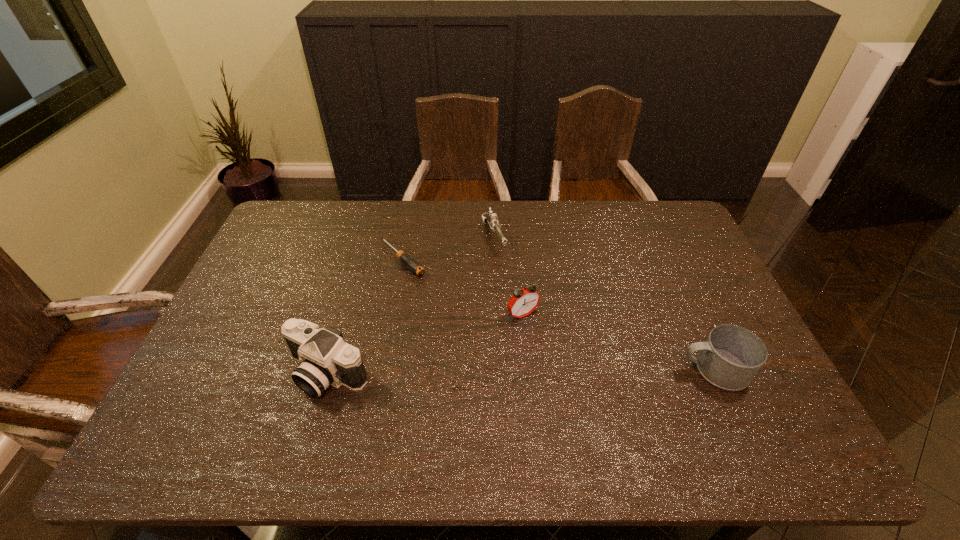
Identify the location of object that stands as the third closest to the rightmost object. (414, 266).

Identify the location of blank area in the image that satisfies the following two spatial constraints: 1. on the back side of the alarm clock; 2. on the right side of the tallest object. (345, 315).

Where is `free spot that satisfies the following two spatial constraints: 1. on the back side of the third farthest object; 2. on the right side of the tallest object`? This screenshot has height=540, width=960. free spot that satisfies the following two spatial constraints: 1. on the back side of the third farthest object; 2. on the right side of the tallest object is located at coordinates (345, 315).

Locate an element on the screen. blank space that satisfies the following two spatial constraints: 1. on the front side of the third farthest object; 2. on the left side of the gun is located at coordinates (496, 315).

Locate an element on the screen. vacant space that satisfies the following two spatial constraints: 1. on the front side of the gun; 2. on the side of the rightmost object with the handle is located at coordinates (498, 369).

Find the location of `free space in the image that satisfies the following two spatial constraints: 1. on the front side of the gun; 2. on the side of the rightmost object with the handle`. free space in the image that satisfies the following two spatial constraints: 1. on the front side of the gun; 2. on the side of the rightmost object with the handle is located at coordinates (498, 369).

The image size is (960, 540). What are the coordinates of `blank area in the image that satisfies the following two spatial constraints: 1. on the back side of the mug; 2. on the side of the tallest object with the handle` in the screenshot? It's located at (329, 369).